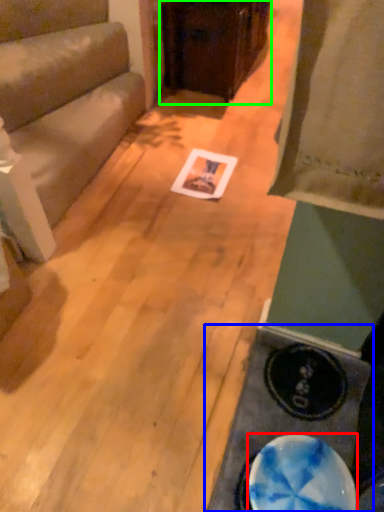
Question: Based on their relative distances, which object is farther from plate (highlighted by a red box)? Choose from table (highlighted by a blue box) and furniture (highlighted by a green box).

Choices:
 (A) table
 (B) furniture

Answer: (B)